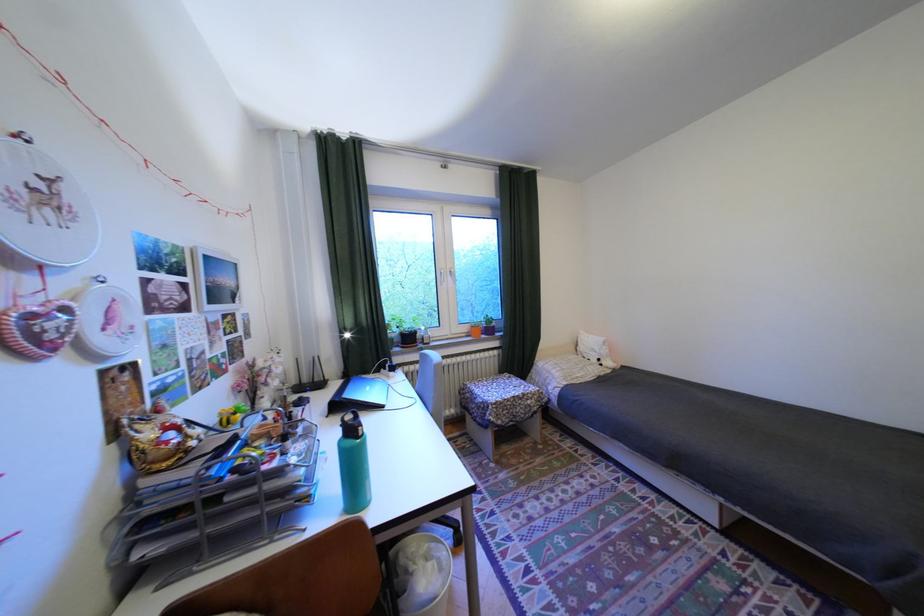
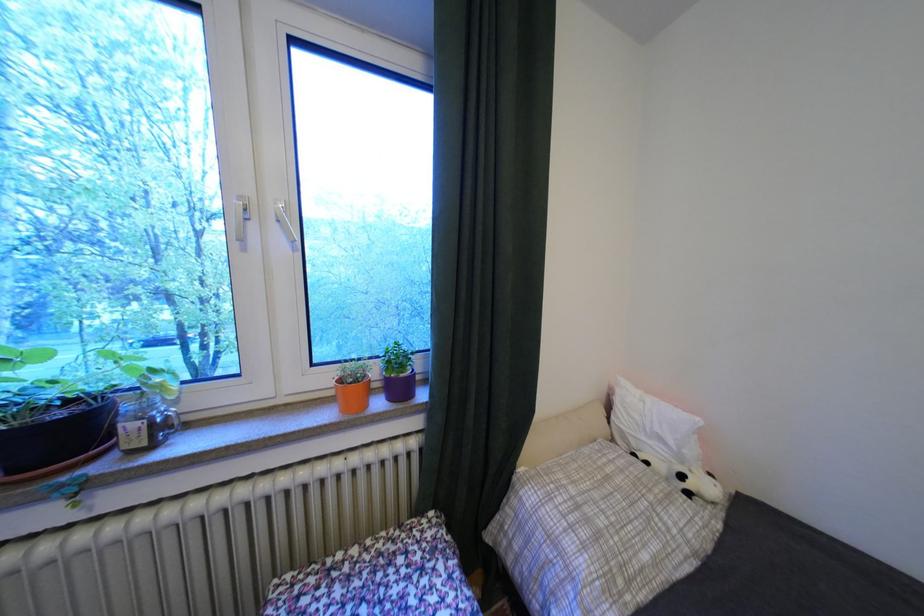
Where in the second image is the point corresponding to (x=421, y=339) from the first image?

(75, 436)